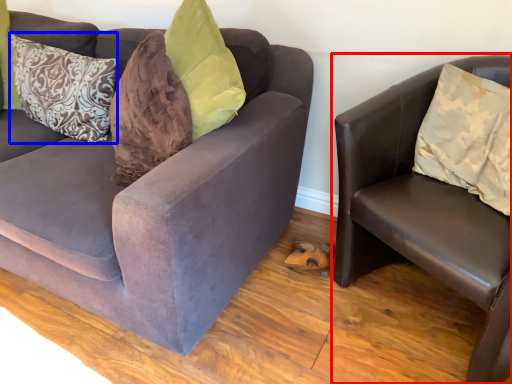
Question: Which of the following is the closest to the observer, studio couch (highlighted by a red box) or pillow (highlighted by a blue box)?

Choices:
 (A) studio couch
 (B) pillow

Answer: (A)